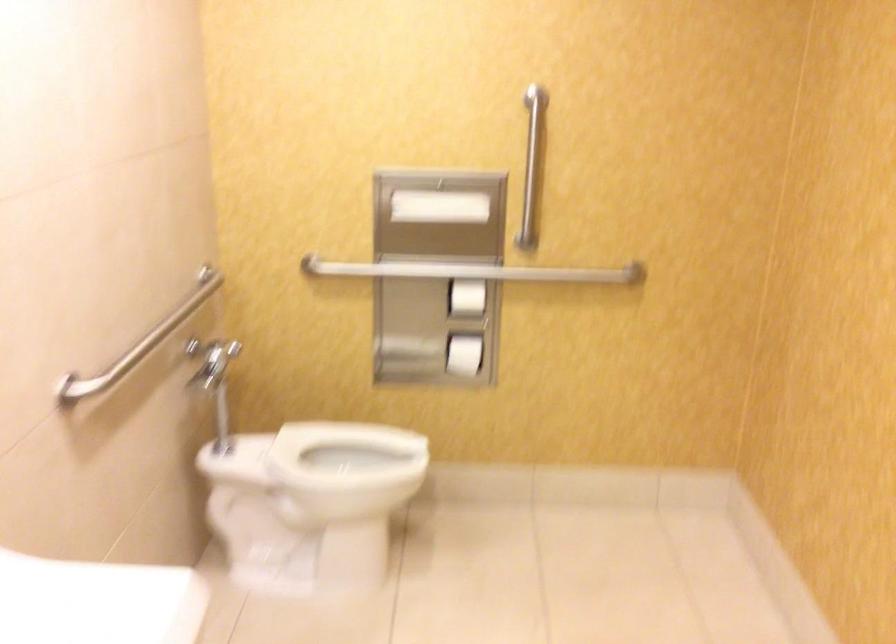
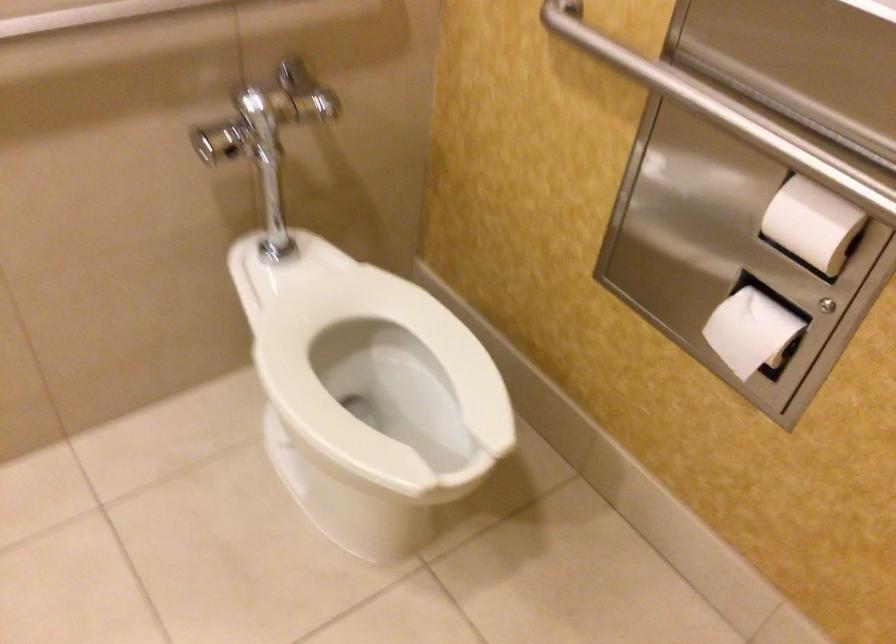
Find the pixel in the second image that matches point (476, 295) in the first image.

(812, 223)